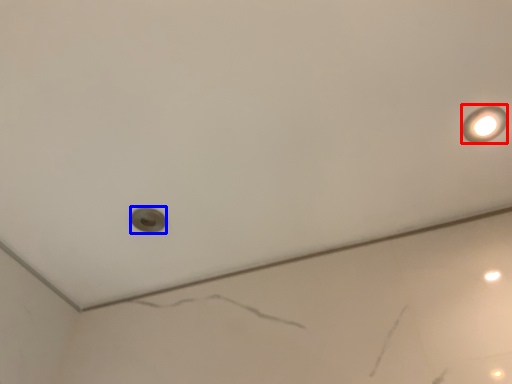
Question: Which object is further to the camera taking this photo, light fixture (highlighted by a red box) or hole (highlighted by a blue box)?

Choices:
 (A) light fixture
 (B) hole

Answer: (B)